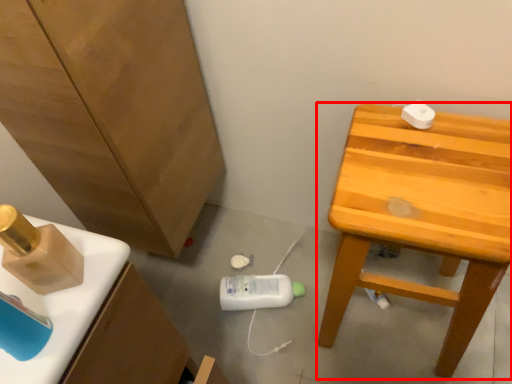
Question: Considering the relative positions of stool (annotated by the red box) and cabinetry in the image provided, where is stool (annotated by the red box) located with respect to the staircase?

Choices:
 (A) right
 (B) left

Answer: (A)